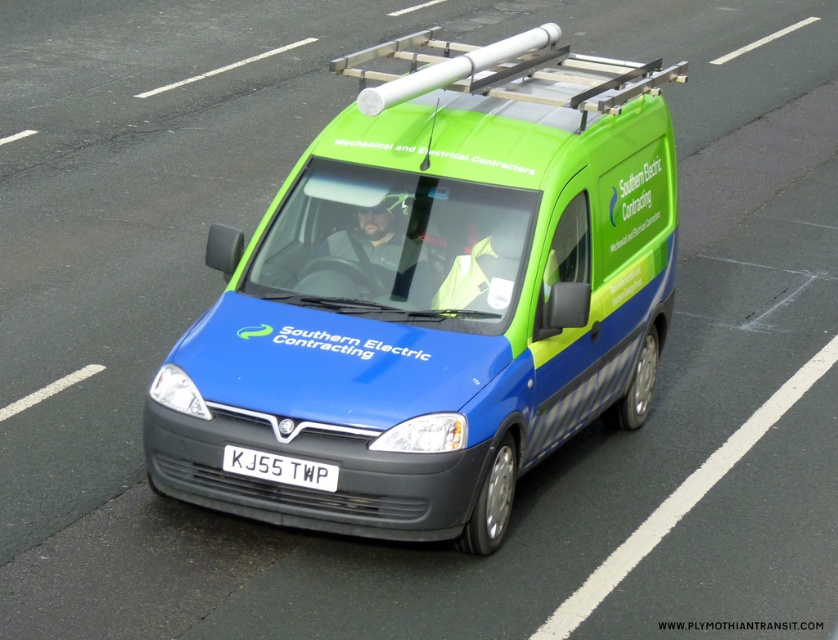
You are a delivery person who needs to attach a GPS tracker to the blue matte van at center. The GPS tracker must be placed within 1.5 meters of the white plastic license plate at center. Can you place the tracker on the van without exceeding the distance limit?

The blue matte van at center and white plastic license plate at center are 1.58 meters apart. Since the required distance for the GPS tracker is within 1.5 meters, placing it on the van would exceed the limit by 0.08 meters, so it cannot be placed within the specified distance.

You are a delivery driver who needs to confirm the vehicle details for a job. You see the blue matte van at center and the white plastic license plate at center. Which one has a bigger size?

The blue matte van at center is larger in size than the white plastic license plate at center.